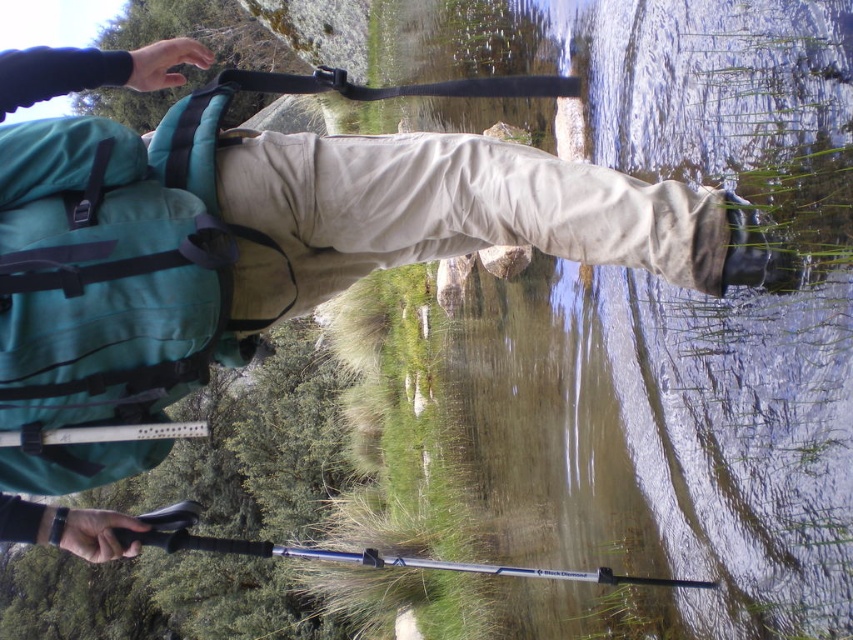
Which of these two, clear water at lower center or khaki cotton pants at center, stands shorter?

khaki cotton pants at center

Between clear water at lower center and khaki cotton pants at center, which one is positioned higher?

khaki cotton pants at center is above.

Who is more forward, (786,72) or (263,280)?

Point (786,72) is in front.

Locate an element on the screen. The height and width of the screenshot is (640, 853). clear water at lower center is located at coordinates (663, 448).

In the scene shown: Can you confirm if clear water at lower center is bigger than teal fabric backpack at left?

Indeed, clear water at lower center has a larger size compared to teal fabric backpack at left.

Is point (850, 266) in front of point (78, 250)?

Yes, it is.

The height and width of the screenshot is (640, 853). In order to click on clear water at lower center in this screenshot , I will do `click(663, 448)`.

Can you confirm if teal fabric backpack at left is positioned below khaki cotton pants at center?

Indeed, teal fabric backpack at left is positioned under khaki cotton pants at center.

Which is more to the right, teal fabric backpack at left or khaki cotton pants at center?

From the viewer's perspective, khaki cotton pants at center appears more on the right side.

Which is behind, point (209, 268) or point (366, 177)?

Positioned behind is point (366, 177).

At what (x,y) coordinates should I click in order to perform the action: click on teal fabric backpack at left. Please return your answer as a coordinate pair (x, y). This screenshot has height=640, width=853. Looking at the image, I should click on (106, 272).